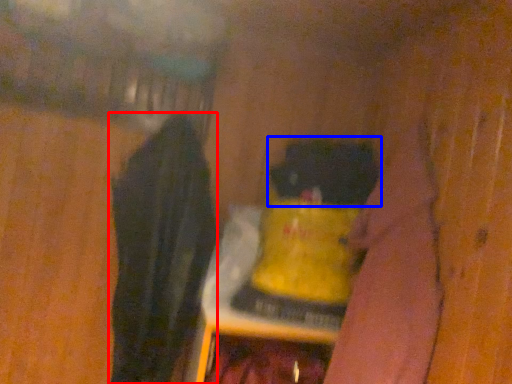
Question: Among these objects, which one is nearest to the camera, clothing (highlighted by a red box) or animal (highlighted by a blue box)?

Choices:
 (A) clothing
 (B) animal

Answer: (A)